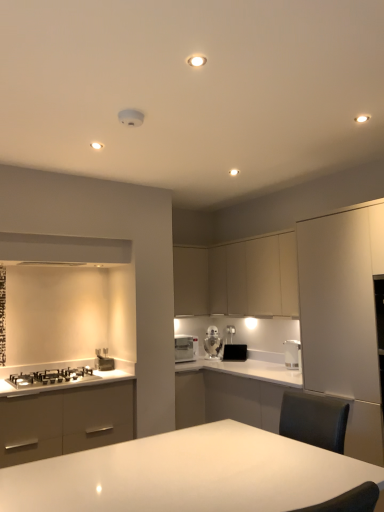
What is the approximate width of matte beige cabinet at center, placed as the 1th cabinetry when sorted from back to front?

matte beige cabinet at center, placed as the 1th cabinetry when sorted from back to front, is 12.72 inches wide.

This screenshot has height=512, width=384. What do you see at coordinates (190, 281) in the screenshot?
I see `matte beige cabinet at center, the 3th cabinetry positioned from the front` at bounding box center [190, 281].

Locate an element on the screen. The width and height of the screenshot is (384, 512). satin silver toaster at lower left, which ranks as the 2th appliance in right-to-left order is located at coordinates (103, 360).

How much space does satin silver toaster at lower left, which ranks as the 2th appliance in right-to-left order, occupy horizontally?

satin silver toaster at lower left, which ranks as the 2th appliance in right-to-left order, is 14.53 centimeters in width.

In order to face white glossy toaster at center, which is the third kitchen appliance in front-to-back order, should I rotate leftwards or rightwards?

You should look right and rotate roughly 3.151 degrees.

You are a GUI agent. You are given a task and a screenshot of the screen. Output one action in this format:
    pyautogui.click(x=<x>, y=<y>)
    Task: Click on the matte beige cabinet at center, placed as the 1th cabinetry when sorted from back to front
    The width and height of the screenshot is (384, 512).
    Given the screenshot: What is the action you would take?
    pyautogui.click(x=190, y=281)

Could you measure the distance between white glossy microwave at center, which ranks as the 3th kitchen appliance in right-to-left order, and satin silver toaster at lower left, the 1th appliance from the front?

white glossy microwave at center, which ranks as the 3th kitchen appliance in right-to-left order, and satin silver toaster at lower left, the 1th appliance from the front, are 29.72 inches apart.

Between point (180, 337) and point (106, 347), which one is positioned behind?

The point (180, 337) is farther.

From a real-world perspective, is white glossy microwave at center, the 2th kitchen appliance positioned from the front, physically located above or below satin silver toaster at lower left, which is the second appliance in back-to-front order?

white glossy microwave at center, the 2th kitchen appliance positioned from the front, is above satin silver toaster at lower left, which is the second appliance in back-to-front order.

Which is correct: white glossy microwave at center, positioned as the 1th kitchen appliance in left-to-right order, is inside satin silver toaster at lower left, which is the second appliance in back-to-front order, or outside of it?

white glossy microwave at center, positioned as the 1th kitchen appliance in left-to-right order, cannot be found inside satin silver toaster at lower left, which is the second appliance in back-to-front order.

Is white glossy countertop at lower left touching satin silver kettle at right, the 1th kitchen appliance from the front?

white glossy countertop at lower left and satin silver kettle at right, the 1th kitchen appliance from the front, are clearly separated.

How different are the orientations of white glossy countertop at lower left and satin silver kettle at right, placed as the first kitchen appliance when sorted from right to left, in degrees?

There is a 91.1-degree angle between the facing directions of white glossy countertop at lower left and satin silver kettle at right, placed as the first kitchen appliance when sorted from right to left.

Is point (3, 393) more distant than point (287, 355)?

No, it is not.

From a real-world perspective, is white matte cabinet at right, which is counted as the 3th cabinetry, starting from the back, positioned under matte white cabinets at upper center, acting as the second cabinetry starting from the back, based on gravity?

Correct, in the physical world, white matte cabinet at right, which is counted as the 3th cabinetry, starting from the back, is lower than matte white cabinets at upper center, acting as the second cabinetry starting from the back.

Which of these two, white matte cabinet at right, the first cabinetry from the front, or matte white cabinets at upper center, acting as the second cabinetry starting from the back, is smaller?

Smaller between the two is matte white cabinets at upper center, acting as the second cabinetry starting from the back.

Is white matte cabinet at right, which is counted as the 3th cabinetry, starting from the back, inside or outside of matte white cabinets at upper center, acting as the second cabinetry starting from the back?

white matte cabinet at right, which is counted as the 3th cabinetry, starting from the back, is spatially situated outside matte white cabinets at upper center, acting as the second cabinetry starting from the back.

In the scene shown: Is white matte cabinet at right, the first cabinetry from the front, wider than matte white cabinets at upper center, acting as the second cabinetry starting from the back?

Correct, the width of white matte cabinet at right, the first cabinetry from the front, exceeds that of matte white cabinets at upper center, acting as the second cabinetry starting from the back.

Considering the sizes of objects white matte cabinet at right, which is counted as the 3th cabinetry, starting from the back, and black matte toaster at center, which ranks as the 1th appliance in back-to-front order, in the image provided, who is smaller, white matte cabinet at right, which is counted as the 3th cabinetry, starting from the back, or black matte toaster at center, which ranks as the 1th appliance in back-to-front order,?

Smaller between the two is black matte toaster at center, which ranks as the 1th appliance in back-to-front order.

Considering the points (341, 227) and (238, 348), which point is behind, point (341, 227) or point (238, 348)?

Positioned behind is point (238, 348).

In the image, is white matte cabinet at right, which is counted as the 3th cabinetry, starting from the back, positioned in front of or behind black matte toaster at center, which is the 2th appliance in front-to-back order?

white matte cabinet at right, which is counted as the 3th cabinetry, starting from the back, is in front of black matte toaster at center, which is the 2th appliance in front-to-back order.

Is white matte cabinet at right, which is counted as the 3th cabinetry, starting from the back, touching black matte toaster at center, marked as the second appliance in a left-to-right arrangement?

No.

Considering the sizes of objects white matte cabinet at right, the first cabinetry from the front, and white glossy table at center in the image provided, who is shorter, white matte cabinet at right, the first cabinetry from the front, or white glossy table at center?

With less height is white glossy table at center.

Which point is more distant from viewer, (369, 329) or (259, 438)?

The point (369, 329) is behind.

Consider the image. From a real-world perspective, between white matte cabinet at right, which is counted as the 3th cabinetry, starting from the back, and white glossy table at center, who is vertically higher?

white matte cabinet at right, which is counted as the 3th cabinetry, starting from the back, is physically above.

From the picture: Between white matte cabinet at right, the first cabinetry from the front, and white glossy table at center, which one has larger width?

Wider between the two is white glossy table at center.

From a real-world perspective, which object rests below the other?

white glossy table at center, from a real-world perspective.

Is white glossy table at center oriented towards white glossy countertop at lower left?

Yes, white glossy table at center is turned towards white glossy countertop at lower left.

Does white glossy table at center have a greater width compared to white glossy countertop at lower left?

Correct, the width of white glossy table at center exceeds that of white glossy countertop at lower left.

I want to click on the 2nd kitchen appliance behind the white matte cabinet at right, the first cabinetry from the front, starting your count from the anchor, so click(x=185, y=348).

Is white matte cabinet at right, which is counted as the 3th cabinetry, starting from the back, at the back of white glossy microwave at center, positioned as the 1th kitchen appliance in left-to-right order?

No, white glossy microwave at center, positioned as the 1th kitchen appliance in left-to-right order, is not facing away from white matte cabinet at right, which is counted as the 3th cabinetry, starting from the back.

From a real-world perspective, who is located lower, white glossy microwave at center, the 2th kitchen appliance positioned from the front, or white matte cabinet at right, the first cabinetry from the front?

From a 3D spatial view, white glossy microwave at center, the 2th kitchen appliance positioned from the front, is below.

Does white glossy microwave at center, which ranks as the 3th kitchen appliance in right-to-left order, have a greater height compared to white matte cabinet at right, the first cabinetry from the front?

Incorrect, the height of white glossy microwave at center, which ranks as the 3th kitchen appliance in right-to-left order, is not larger of that of white matte cabinet at right, the first cabinetry from the front.

Which kitchen appliance is the 1st one when counting from the back of the satin silver toaster at lower left, the 1th appliance from the front? Please provide its 2D coordinates.

[(185, 348)]

Locate an element on the screen. The image size is (384, 512). countertop that is on the left side of satin silver kettle at right, which is the 3th kitchen appliance from left to right is located at coordinates (63, 383).

Estimate the real-world distances between objects in this image. Which object is further from white glossy countertop at lower left, white glossy toaster at center, which is the second kitchen appliance from left to right, or satin silver kettle at right, placed as the first kitchen appliance when sorted from right to left?

satin silver kettle at right, placed as the first kitchen appliance when sorted from right to left.

Looking at the image, which one is located closer to white glossy toaster at center, which is the third kitchen appliance in front-to-back order, satin silver toaster at lower left, which is the second appliance in back-to-front order, or white glossy table at center?

The object closer to white glossy toaster at center, which is the third kitchen appliance in front-to-back order, is satin silver toaster at lower left, which is the second appliance in back-to-front order.

From the image, which object appears to be farther from white matte cabinet at right, which is counted as the 3th cabinetry, starting from the back, black matte toaster at center, positioned as the first appliance in right-to-left order, or satin silver toaster at lower left, which ranks as the 2th appliance in right-to-left order?

satin silver toaster at lower left, which ranks as the 2th appliance in right-to-left order, is positioned further to the anchor white matte cabinet at right, which is counted as the 3th cabinetry, starting from the back.

Estimate the real-world distances between objects in this image. Which object is closer to white glossy countertop at lower left, white glossy table at center or white matte cabinet at right, the first cabinetry from the front?

The object closer to white glossy countertop at lower left is white matte cabinet at right, the first cabinetry from the front.

Based on their spatial positions, is white glossy microwave at center, the 2th kitchen appliance positioned from the front, or matte beige cabinet at center, the 3th cabinetry positioned from the front, further from white glossy toaster at center, which is the second kitchen appliance from left to right?

matte beige cabinet at center, the 3th cabinetry positioned from the front, is further to white glossy toaster at center, which is the second kitchen appliance from left to right.

From the image, which object appears to be nearer to white glossy toaster at center, marked as the first kitchen appliance in a back-to-front arrangement, satin silver kettle at right, the 1th kitchen appliance from the front, or white glossy countertop at lower left?

satin silver kettle at right, the 1th kitchen appliance from the front.

When comparing their distances from satin silver kettle at right, the 1th kitchen appliance from the front, does black matte toaster at center, marked as the second appliance in a left-to-right arrangement, or matte beige cabinet at center, placed as the 1th cabinetry when sorted from back to front, seem further?

matte beige cabinet at center, placed as the 1th cabinetry when sorted from back to front.

Looking at the image, which one is located closer to matte white cabinets at upper center, acting as the second cabinetry starting from the back, white glossy table at center or matte beige cabinet at center, placed as the 1th cabinetry when sorted from back to front?

matte beige cabinet at center, placed as the 1th cabinetry when sorted from back to front, is closer to matte white cabinets at upper center, acting as the second cabinetry starting from the back.

The width and height of the screenshot is (384, 512). Identify the location of appliance between matte beige cabinet at center, placed as the 1th cabinetry when sorted from back to front, and satin silver kettle at right, the 1th kitchen appliance from the front, from left to right. (235, 352).

The width and height of the screenshot is (384, 512). What are the coordinates of `cabinetry between matte white cabinets at upper center, the 2th cabinetry positioned from the front, and white glossy toaster at center, which is the third kitchen appliance in front-to-back order, in the front-back direction` in the screenshot? It's located at (190, 281).

This screenshot has height=512, width=384. What are the coordinates of `cabinetry between white glossy countertop at lower left and black matte toaster at center, positioned as the first appliance in right-to-left order, in the horizontal direction` in the screenshot? It's located at (190, 281).

Find the location of a particular element. kitchen appliance located between matte beige cabinet at center, the 3th cabinetry positioned from the front, and satin silver kettle at right, which is the 3th kitchen appliance from left to right, in the left-right direction is located at coordinates (212, 342).